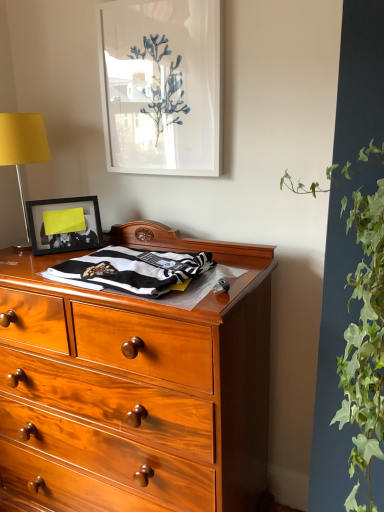
Question: Considering the positions of point (375, 431) and point (112, 273), is point (375, 431) closer or farther from the camera than point (112, 273)?

Choices:
 (A) closer
 (B) farther

Answer: (A)

Question: Is green leafy plant at right bigger or smaller than black and white striped fabric at center?

Choices:
 (A) small
 (B) big

Answer: (B)

Question: Which is farther from the white glossy picture frame at upper center, marked as the second picture frame in a left-to-right arrangement?

Choices:
 (A) matte black picture frame at upper left, the first picture frame from the left
 (B) black and white striped fabric at center
 (C) yellow fabric lampshade at left
 (D) green leafy plant at right

Answer: (D)

Question: Estimate the real-world distances between objects in this image. Which object is closer to the green leafy plant at right?

Choices:
 (A) matte black picture frame at upper left, the first picture frame from the left
 (B) black and white striped fabric at center
 (C) white glossy picture frame at upper center, the 1th picture frame in the top-to-bottom sequence
 (D) yellow fabric lampshade at left

Answer: (B)